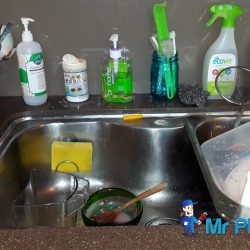
This screenshot has width=250, height=250. I want to click on spoon handle, so click(x=153, y=189).